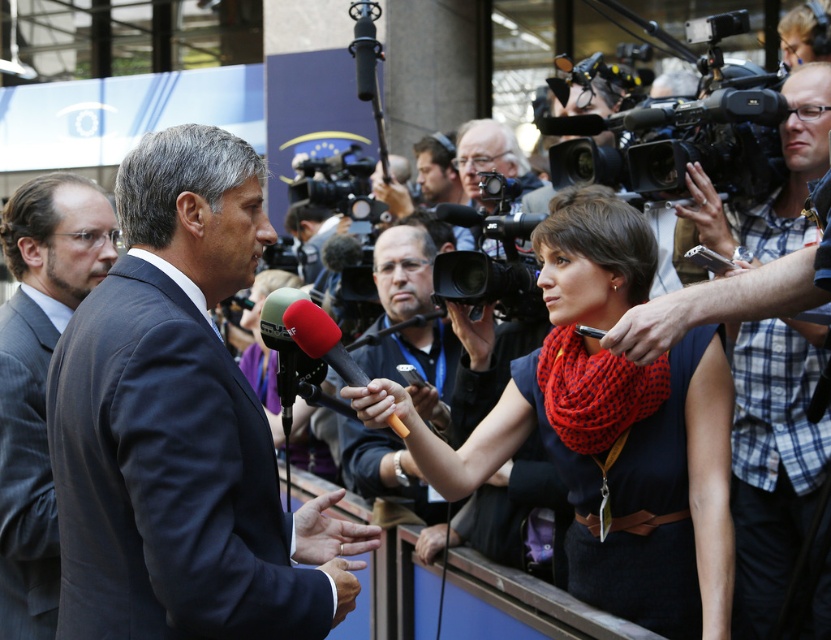
Question: Can you confirm if gray suit at left is positioned above plaid shirt at right?

Choices:
 (A) no
 (B) yes

Answer: (A)

Question: Can you confirm if gray wool suit at left is positioned to the right of plaid shirt at right?

Choices:
 (A) yes
 (B) no

Answer: (B)

Question: Which of the following is the closest to the observer?

Choices:
 (A) click(28, 576)
 (B) click(666, 608)

Answer: (B)

Question: Which point appears farthest from the camera in this image?

Choices:
 (A) (230, 376)
 (B) (406, 230)
 (C) (288, 333)

Answer: (B)

Question: Which of the following is the closest to the observer?

Choices:
 (A) matte black microphone at center
 (B) dark gray suit at center

Answer: (B)

Question: Is dark gray suit at center further to the viewer compared to gray wool suit at left?

Choices:
 (A) no
 (B) yes

Answer: (A)